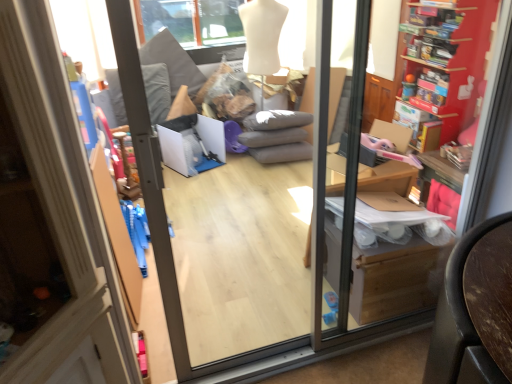
Question: Does point (448, 64) appear closer or farther from the camera than point (234, 281)?

Choices:
 (A) closer
 (B) farther

Answer: (B)

Question: In the image, is wooden bookshelf at right positioned in front of or behind transparent glass screen door at center?

Choices:
 (A) behind
 (B) front

Answer: (A)

Question: Which object is the farthest from the matte cardboard box at right?

Choices:
 (A) transparent glass screen door at center
 (B) wooden bookshelf at right

Answer: (B)

Question: Which object is the closest to the wooden bookshelf at right?

Choices:
 (A) transparent glass screen door at center
 (B) matte cardboard box at right

Answer: (B)